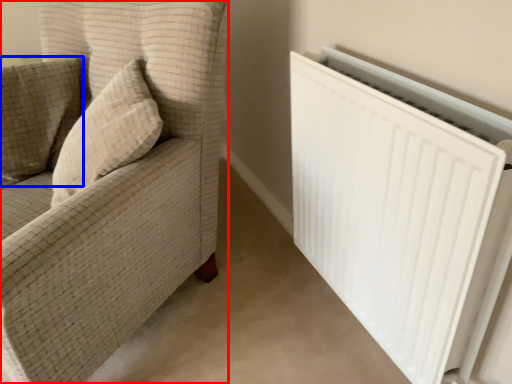
Question: Among these objects, which one is nearest to the camera, furniture (highlighted by a red box) or pillow (highlighted by a blue box)?

Choices:
 (A) furniture
 (B) pillow

Answer: (A)